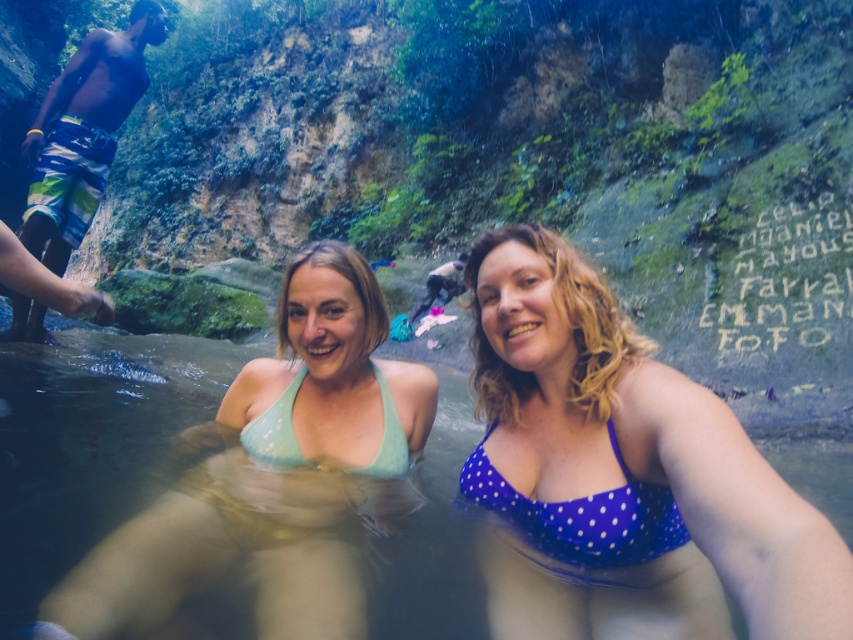
Which is more to the right, matte green bikini top at center or blue polka dot bikini top at center?

Positioned to the right is blue polka dot bikini top at center.

Is point (334, 470) closer to camera compared to point (604, 513)?

No, (334, 470) is further to viewer.

Where is `matte green bikini top at center`? matte green bikini top at center is located at coordinates (274, 472).

Does blue polka dot bikini at center have a lesser width compared to multicolored striped shorts at left?

Indeed, blue polka dot bikini at center has a lesser width compared to multicolored striped shorts at left.

What do you see at coordinates (630, 442) in the screenshot?
I see `blue polka dot bikini at center` at bounding box center [630, 442].

This screenshot has height=640, width=853. Find the location of `blue polka dot bikini at center`. blue polka dot bikini at center is located at coordinates (630, 442).

Which of these two, matte green bikini top at center or multicolored striped shorts at left, stands taller?

Standing taller between the two is multicolored striped shorts at left.

Is matte green bikini top at center wider than multicolored striped shorts at left?

Yes.

Does point (270, 401) come closer to viewer compared to point (80, 122)?

Yes, it is.

At what (x,y) coordinates should I click in order to perform the action: click on matte green bikini top at center. Please return your answer as a coordinate pair (x, y). Looking at the image, I should click on (274, 472).